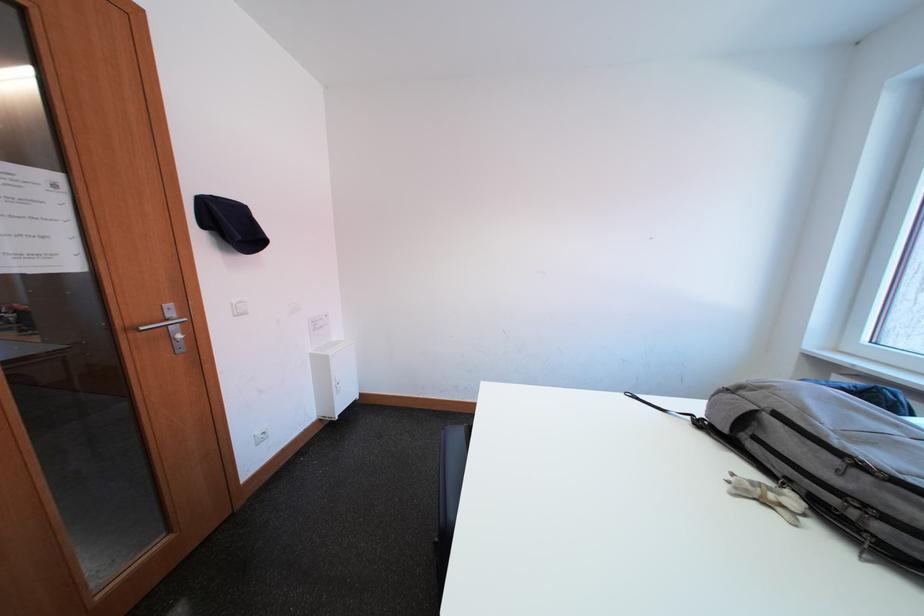
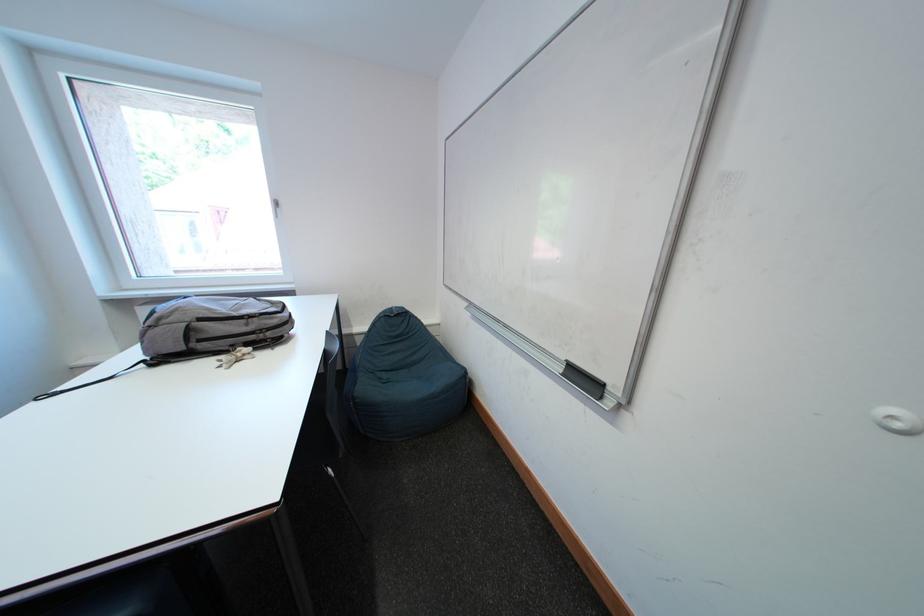
The point at (798, 484) is marked in the first image. Where is the corresponding point in the second image?

(241, 349)